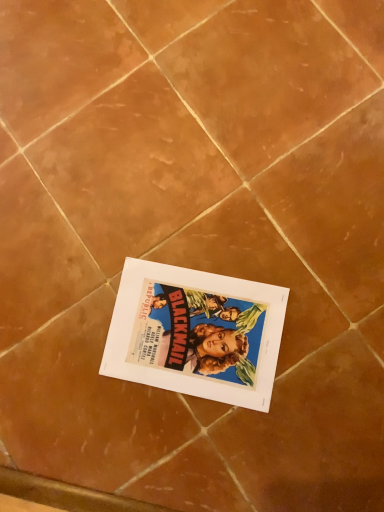
What is the approximate height of matte paper poster at center?

A: The height of matte paper poster at center is 0.40 inches.

Describe the element at coordinates (196, 333) in the screenshot. This screenshot has height=512, width=384. I see `matte paper poster at center` at that location.

The height and width of the screenshot is (512, 384). In order to click on matte paper poster at center in this screenshot , I will do coord(196,333).

The width and height of the screenshot is (384, 512). Identify the location of matte paper poster at center. (196, 333).